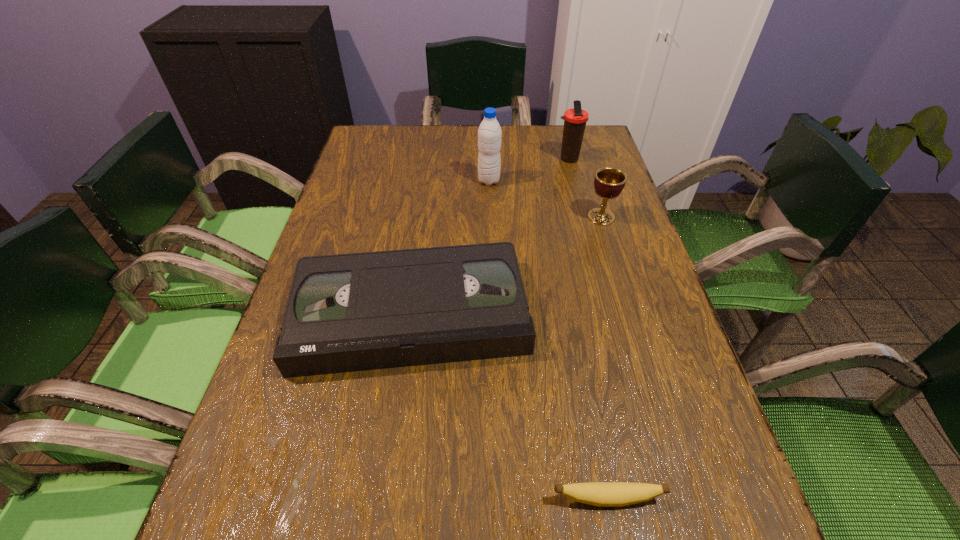
Locate an element on the screen. This screenshot has width=960, height=540. vacant space situated 0.130m on the front of the fourth nearest object is located at coordinates (490, 217).

You are a GUI agent. You are given a task and a screenshot of the screen. Output one action in this format:
    pyautogui.click(x=<x>, y=<y>)
    Task: Click on the vacant region located 0.100m on the left of the farthest object
    The image size is (960, 540).
    Given the screenshot: What is the action you would take?
    pos(522,159)

What are the coordinates of `free space located 0.050m on the back of the third tallest object` in the screenshot? It's located at (595, 197).

In order to click on vacant region located on the back of the videotape in this screenshot , I will do `click(424, 221)`.

Where is `free location located on the left of the banana`? This screenshot has height=540, width=960. free location located on the left of the banana is located at coordinates [x=478, y=498].

The image size is (960, 540). Identify the location of object positioned at the far edge. (575, 119).

Where is `object located in the left edge section of the desktop`? Image resolution: width=960 pixels, height=540 pixels. object located in the left edge section of the desktop is located at coordinates (350, 312).

Locate an element on the screen. The image size is (960, 540). thermos bottle present at the right edge is located at coordinates (575, 119).

Where is `chalice located in the right edge section of the desktop`? The height and width of the screenshot is (540, 960). chalice located in the right edge section of the desktop is located at coordinates (609, 182).

You are a GUI agent. You are given a task and a screenshot of the screen. Output one action in this format:
    pyautogui.click(x=<x>, y=<y>)
    Task: Click on the banana present at the right edge
    
    Given the screenshot: What is the action you would take?
    pyautogui.click(x=604, y=494)